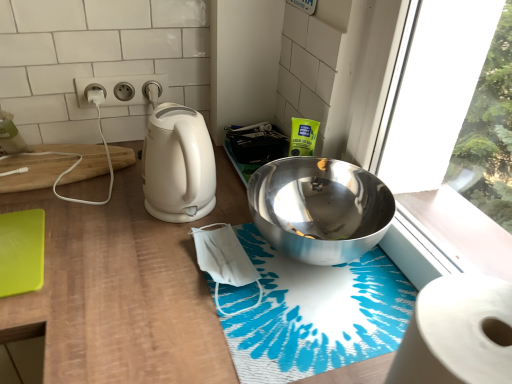
Identify the location of free space to the left of white glossy electric kettle at left. (110, 217).